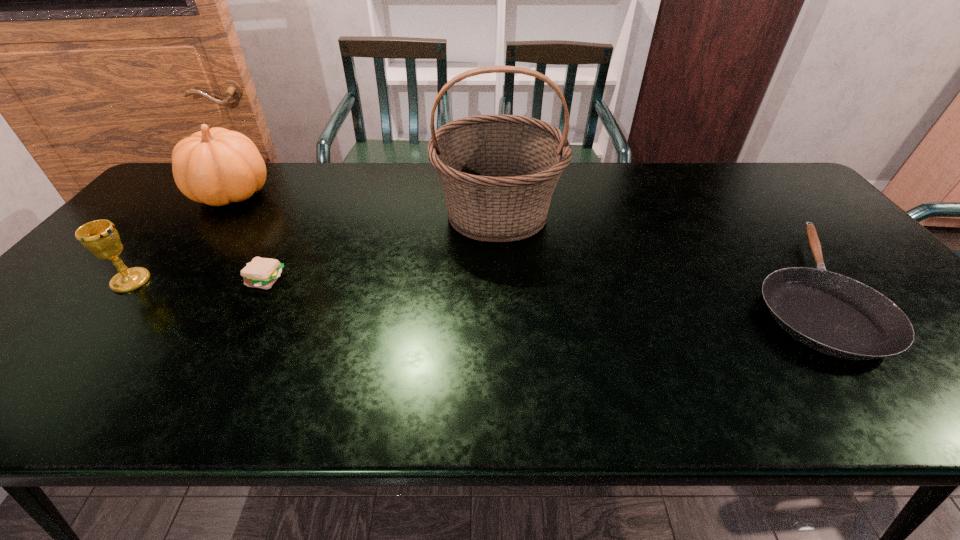
Locate an element on the screen. The width and height of the screenshot is (960, 540). vacant space at the right edge is located at coordinates (826, 240).

In the image, there is a desktop. At what (x,y) coordinates should I click in order to perform the action: click on vacant space at the far right corner. Please return your answer as a coordinate pair (x, y). Looking at the image, I should click on (771, 170).

This screenshot has width=960, height=540. Identify the location of free space between the third object from left to right and the tallest object. (381, 247).

Image resolution: width=960 pixels, height=540 pixels. In order to click on free space between the patty and the rightmost object in this screenshot , I will do `click(534, 285)`.

Locate an element on the screen. This screenshot has height=540, width=960. vacant space that's between the third object from left to right and the third tallest object is located at coordinates (198, 281).

Where is `free spot between the third object from right to left and the second tallest object`? free spot between the third object from right to left and the second tallest object is located at coordinates (249, 238).

Where is `free space between the basket and the fourth shortest object`? free space between the basket and the fourth shortest object is located at coordinates (365, 204).

You are a GUI agent. You are given a task and a screenshot of the screen. Output one action in this format:
    pyautogui.click(x=<x>, y=<y>)
    Task: Click on the blank region between the patty and the chalice
    This screenshot has width=960, height=540.
    Given the screenshot: What is the action you would take?
    pyautogui.click(x=198, y=281)

The image size is (960, 540). I want to click on free space between the fourth object from left to right and the frying pan, so click(x=650, y=252).

Where is `vacant area that lies between the third object from right to left and the frying pan`? Image resolution: width=960 pixels, height=540 pixels. vacant area that lies between the third object from right to left and the frying pan is located at coordinates (534, 285).